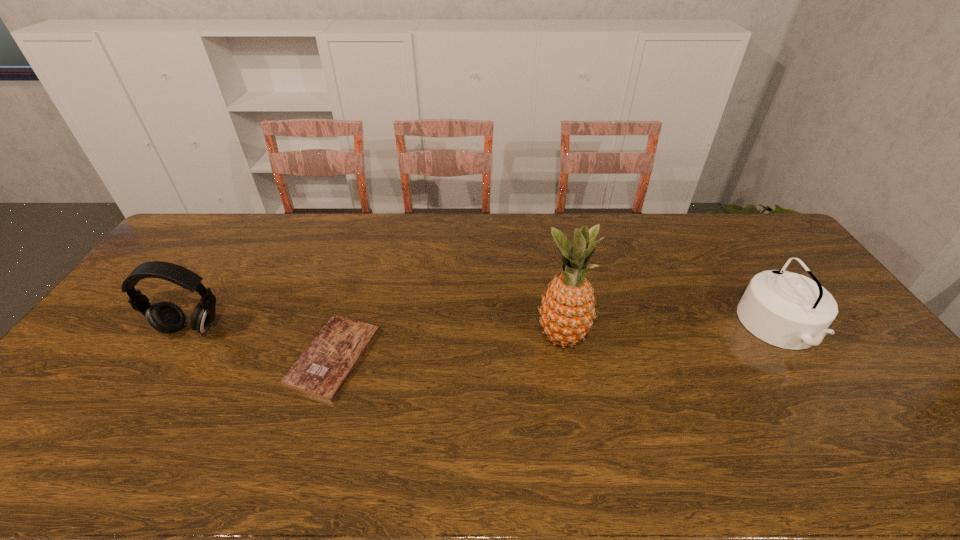
This screenshot has height=540, width=960. I want to click on free space that is in between the leftmost object and the second shortest object, so tap(486, 328).

Find the location of a particular element. The image size is (960, 540). free point between the tallest object and the rightmost object is located at coordinates (672, 333).

Where is `free space that is in between the earphone and the rightmost object`? The width and height of the screenshot is (960, 540). free space that is in between the earphone and the rightmost object is located at coordinates (486, 328).

In order to click on empty location between the Bible and the pineapple in this screenshot , I will do `click(448, 347)`.

This screenshot has height=540, width=960. I want to click on vacant area that lies between the third object from left to right and the third object from right to left, so click(448, 347).

Locate an element on the screen. free spot between the earphone and the third object from right to left is located at coordinates (262, 343).

The height and width of the screenshot is (540, 960). Find the location of `free space between the shortest object and the tallest object`. free space between the shortest object and the tallest object is located at coordinates (448, 347).

Image resolution: width=960 pixels, height=540 pixels. I want to click on the third closest object to the shortest object, so click(x=788, y=310).

You are a GUI agent. You are given a task and a screenshot of the screen. Output one action in this format:
    pyautogui.click(x=<x>, y=<y>)
    Task: Click on the object that can be found as the third closest to the earphone
    
    Given the screenshot: What is the action you would take?
    pyautogui.click(x=788, y=310)

In order to click on vacant area in the image that satisfies the following two spatial constraints: 1. on the spout of the kettle; 2. on the ear cups of the leftmost object in this screenshot , I will do `click(781, 329)`.